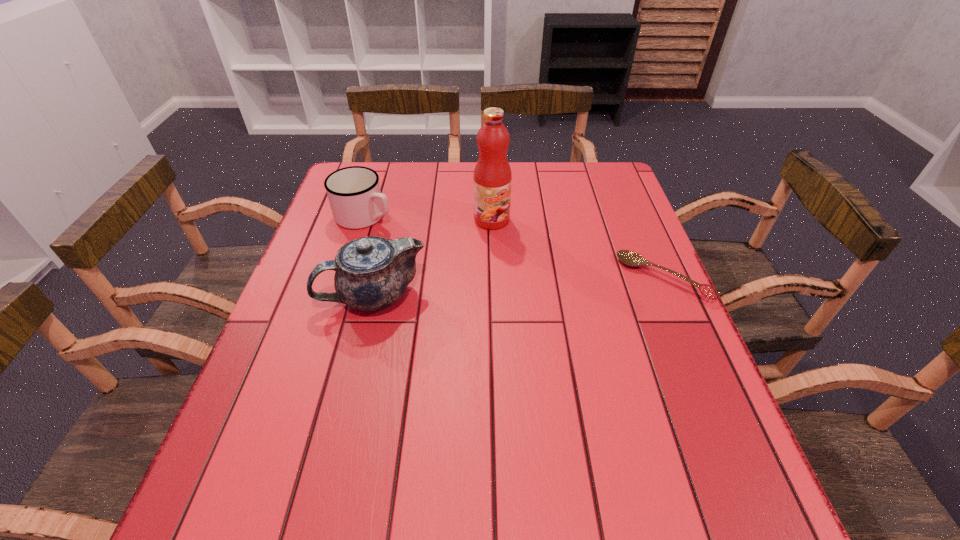
Locate an element on the screen. Image resolution: width=960 pixels, height=540 pixels. vacant space on the desktop that is between the chinaware and the shortest object and is positioned on the side of the third tallest object with the handle is located at coordinates (530, 286).

You are a GUI agent. You are given a task and a screenshot of the screen. Output one action in this format:
    pyautogui.click(x=<x>, y=<y>)
    Task: Click on the free space on the desktop that is between the chinaware and the shortest object and is positioned on the front label of the fruit juice
    The image size is (960, 540).
    Given the screenshot: What is the action you would take?
    pyautogui.click(x=548, y=285)